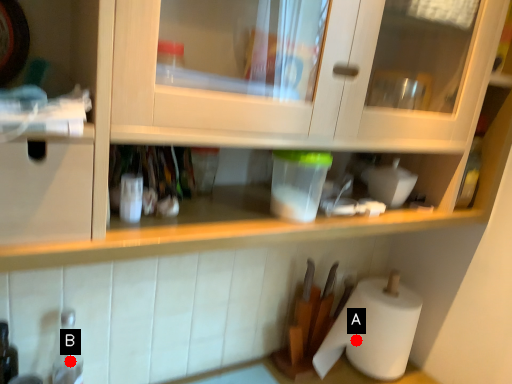
Question: Two points are circled on the image, labeled by A and B beside each circle. Which of the following is the farthest from the observer?

Choices:
 (A) A is further
 (B) B is further

Answer: (A)